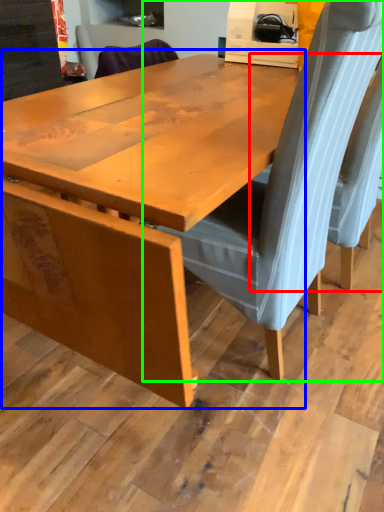
Question: Considering the real-world distances, which object is closest to chair (highlighted by a red box)? table (highlighted by a blue box) or chair (highlighted by a green box).

Choices:
 (A) table
 (B) chair

Answer: (B)